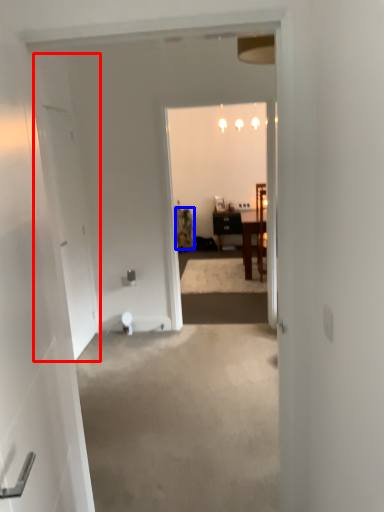
Question: Which object is closer to the camera taking this photo, door (highlighted by a red box) or houseplant (highlighted by a blue box)?

Choices:
 (A) door
 (B) houseplant

Answer: (A)